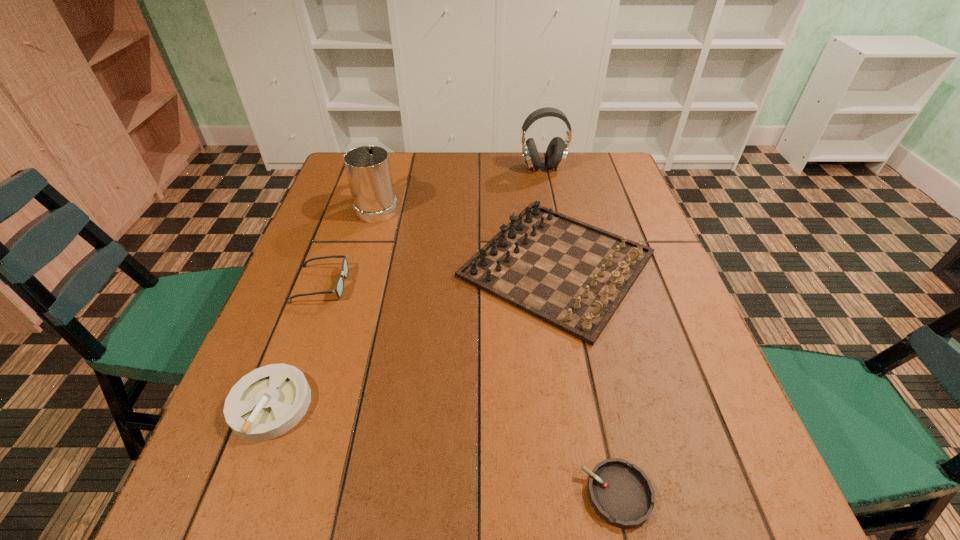
Where is `spectacles that is at the left edge`? The height and width of the screenshot is (540, 960). spectacles that is at the left edge is located at coordinates (339, 287).

Find the location of a particular element. The image size is (960, 540). ashtray that is at the left edge is located at coordinates (266, 403).

Locate an element on the screen. The height and width of the screenshot is (540, 960). object that is positioned at the right edge is located at coordinates (572, 275).

I want to click on object that is at the far left corner, so click(368, 170).

Find the location of `vacant space at the far edge of the desktop`. vacant space at the far edge of the desktop is located at coordinates (426, 163).

This screenshot has height=540, width=960. In order to click on free spot at the near edge of the desktop in this screenshot , I will do `click(491, 494)`.

Locate an element on the screen. This screenshot has height=540, width=960. vacant position at the left edge of the desktop is located at coordinates (310, 235).

Where is `free space at the right edge of the desktop`? This screenshot has height=540, width=960. free space at the right edge of the desktop is located at coordinates (712, 431).

The image size is (960, 540). What are the coordinates of `free space at the far right corner of the desktop` in the screenshot? It's located at (584, 188).

Locate an element on the screen. Image resolution: width=960 pixels, height=540 pixels. empty space between the shortest object and the chessboard is located at coordinates (587, 380).